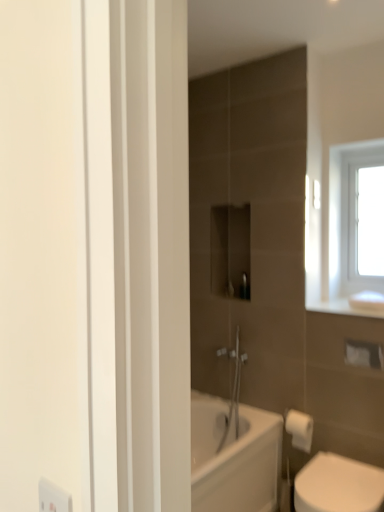
In order to click on white glossy toilet at lower right in this screenshot , I will do `click(338, 485)`.

You are a GUI agent. You are given a task and a screenshot of the screen. Output one action in this format:
    pyautogui.click(x=<x>, y=<y>)
    Task: Click on the white glass window at upper right
    
    Given the screenshot: What is the action you would take?
    pyautogui.click(x=349, y=217)

Where is `white glossy toilet at lower right`? This screenshot has width=384, height=512. white glossy toilet at lower right is located at coordinates (338, 485).

This screenshot has width=384, height=512. I want to click on toilet on the right of the white matte toilet paper at lower right, so click(338, 485).

Does white glossy toilet at lower right lie in front of white matte toilet paper at lower right?

Yes, white glossy toilet at lower right is closer to the camera.

Which of these two, white glossy toilet at lower right or white matte toilet paper at lower right, is bigger?

Bigger between the two is white glossy toilet at lower right.

Considering the relative sizes of white glossy toilet at lower right and white matte toilet paper at lower right in the image provided, is white glossy toilet at lower right wider than white matte toilet paper at lower right?

Yes.

Who is more distant, white glossy toilet at lower right or white glass window at upper right?

white glass window at upper right is more distant.

Is white glossy toilet at lower right situated inside white glass window at upper right or outside?

white glossy toilet at lower right is not enclosed by white glass window at upper right.

Considering the positions of objects white glossy toilet at lower right and white glass window at upper right in the image provided, who is more to the right, white glossy toilet at lower right or white glass window at upper right?

white glass window at upper right.

Considering the positions of point (294, 420) and point (355, 273), is point (294, 420) closer or farther from the camera than point (355, 273)?

Point (294, 420) is positioned closer to the camera compared to point (355, 273).

Is white matte toilet paper at lower right at the left side of white glass window at upper right?

Correct, you'll find white matte toilet paper at lower right to the left of white glass window at upper right.

Which is in front, white matte toilet paper at lower right or white glass window at upper right?

white matte toilet paper at lower right is closer to the camera.

From the picture: Do you think white glass window at upper right is within white glossy toilet at lower right, or outside of it?

white glass window at upper right is not enclosed by white glossy toilet at lower right.

Is white glass window at upper right facing towards white glossy toilet at lower right?

No, white glass window at upper right is not turned towards white glossy toilet at lower right.

Does white glass window at upper right have a greater height compared to white glossy toilet at lower right?

Yes.

Between white glass window at upper right and white glossy toilet at lower right, which one is positioned behind?

white glass window at upper right is behind.

In the scene shown: Considering the relative sizes of white matte toilet paper at lower right and white glossy toilet at lower right in the image provided, is white matte toilet paper at lower right taller than white glossy toilet at lower right?

No.

From the picture: Can you confirm if white matte toilet paper at lower right is positioned to the left of white glossy toilet at lower right?

Yes.

Looking at this image, looking at the image, does white matte toilet paper at lower right seem bigger or smaller compared to white glossy toilet at lower right?

Considering their sizes, white matte toilet paper at lower right takes up less space than white glossy toilet at lower right.

Is white glass window at upper right next to white matte toilet paper at lower right?

No, white glass window at upper right is not in contact with white matte toilet paper at lower right.

Can you confirm if white glass window at upper right is bigger than white matte toilet paper at lower right?

Indeed, white glass window at upper right has a larger size compared to white matte toilet paper at lower right.

From a real-world perspective, is white glass window at upper right located beneath white matte toilet paper at lower right?

No.

Could you tell me if white glass window at upper right is turned towards white matte toilet paper at lower right?

No, white glass window at upper right does not turn towards white matte toilet paper at lower right.

Locate an element on the screen. toilet lying in front of the white matte toilet paper at lower right is located at coordinates (338, 485).

In the image, there is a white glass window at upper right. Where is `toilet below it (from a real-world perspective)`? toilet below it (from a real-world perspective) is located at coordinates pos(338,485).

Estimate the real-world distances between objects in this image. Which object is further from white glass window at upper right, white matte toilet paper at lower right or white glossy toilet at lower right?

The object further to white glass window at upper right is white glossy toilet at lower right.

Estimate the real-world distances between objects in this image. Which object is closer to white matte toilet paper at lower right, white glass window at upper right or white glossy toilet at lower right?

white glossy toilet at lower right is closer to white matte toilet paper at lower right.

Consider the image. Estimate the real-world distances between objects in this image. Which object is further from white glossy toilet at lower right, white matte toilet paper at lower right or white glass window at upper right?

The object further to white glossy toilet at lower right is white glass window at upper right.

Looking at the image, which one is located further to white glass window at upper right, white glossy toilet at lower right or white matte toilet paper at lower right?

Based on the image, white glossy toilet at lower right appears to be further to white glass window at upper right.

Based on their spatial positions, is white glossy toilet at lower right or white glass window at upper right further from white matte toilet paper at lower right?

white glass window at upper right is further to white matte toilet paper at lower right.

Which object lies nearer to the anchor point white glossy toilet at lower right, white glass window at upper right or white matte toilet paper at lower right?

The object closer to white glossy toilet at lower right is white matte toilet paper at lower right.

The width and height of the screenshot is (384, 512). In order to click on toilet paper between white glass window at upper right and white glossy toilet at lower right vertically in this screenshot , I will do `click(299, 429)`.